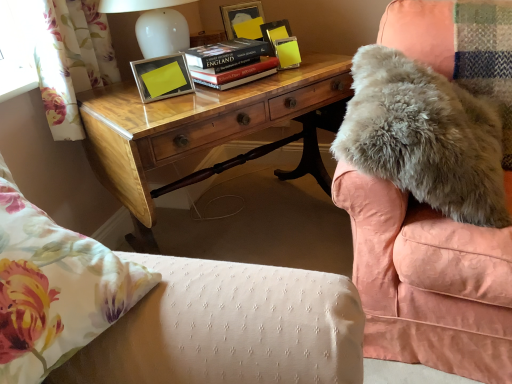
The height and width of the screenshot is (384, 512). I want to click on metallic yellow picture frame at upper center, so click(162, 77).

What are the coordinates of `floral fabric pillow at lower left` in the screenshot? It's located at (55, 288).

The image size is (512, 384). What do you see at coordinates (203, 131) in the screenshot?
I see `wooden desk at center` at bounding box center [203, 131].

This screenshot has height=384, width=512. Find the location of `wooden desk at center`. wooden desk at center is located at coordinates (203, 131).

Looking at this image, in order to face hardcover book at center, should I rotate leftwards or rightwards?

Rotate your view left by about 3.482°.

Identify the location of hardcover book at center. Image resolution: width=512 pixels, height=384 pixels. (237, 74).

The height and width of the screenshot is (384, 512). In order to click on fuzzy gray blanket at upper right in this screenshot , I will do `click(424, 137)`.

Would you consider floral fabric pillow at lower left to be distant from floral fabric curtain at left?

Indeed, floral fabric pillow at lower left is not near floral fabric curtain at left.

From the image's perspective, is floral fabric pillow at lower left beneath floral fabric curtain at left?

Yes, from the image's perspective, floral fabric pillow at lower left is below floral fabric curtain at left.

Does floral fabric pillow at lower left have a lesser width compared to floral fabric curtain at left?

No, floral fabric pillow at lower left is not thinner than floral fabric curtain at left.

Is floral fabric pillow at lower left smaller than floral fabric curtain at left?

Correct, floral fabric pillow at lower left occupies less space than floral fabric curtain at left.

Who is shorter, hardcover book at center or fuzzy gray blanket at upper right?

hardcover book at center.

From the image's perspective, is hardcover book at center beneath fuzzy gray blanket at upper right?

Actually, hardcover book at center appears above fuzzy gray blanket at upper right in the image.

Considering the relative sizes of hardcover book at center and fuzzy gray blanket at upper right in the image provided, is hardcover book at center smaller than fuzzy gray blanket at upper right?

Correct, hardcover book at center occupies less space than fuzzy gray blanket at upper right.

Considering the sizes of hardcover book at center and fuzzy gray blanket at upper right in the image, is hardcover book at center wider or thinner than fuzzy gray blanket at upper right?

hardcover book at center is thinner than fuzzy gray blanket at upper right.

From the picture: Which object is wider, floral fabric curtain at left or hardcover book at center?

hardcover book at center.

From their relative heights in the image, would you say floral fabric curtain at left is taller or shorter than hardcover book at center?

Considering their sizes, floral fabric curtain at left has more height than hardcover book at center.

Relative to hardcover book at center, is floral fabric curtain at left in front or behind?

Clearly, floral fabric curtain at left is in front of hardcover book at center.

From a real-world perspective, is floral fabric curtain at left under hardcover book at center?

Actually, floral fabric curtain at left is physically above hardcover book at center in the real world.

From their relative heights in the image, would you say hardcover book at center is taller or shorter than floral fabric pillow at lower left?

In the image, hardcover book at center appears to be shorter than floral fabric pillow at lower left.

Is hardcover book at center spatially inside floral fabric pillow at lower left, or outside of it?

hardcover book at center exists outside the volume of floral fabric pillow at lower left.

Which of these two, hardcover book at center or floral fabric pillow at lower left, is wider?

With larger width is floral fabric pillow at lower left.

What are the coordinates of `paperback book above the floral fabric pillow at lower left (from the image's perspective)` in the screenshot? It's located at (237, 74).

Considering the sizes of metallic yellow picture frame at upper center and floral fabric curtain at left in the image, is metallic yellow picture frame at upper center wider or thinner than floral fabric curtain at left?

In the image, metallic yellow picture frame at upper center appears to be more narrow than floral fabric curtain at left.

Considering the sizes of metallic yellow picture frame at upper center and floral fabric curtain at left in the image, is metallic yellow picture frame at upper center bigger or smaller than floral fabric curtain at left?

Considering their sizes, metallic yellow picture frame at upper center takes up less space than floral fabric curtain at left.

Is metallic yellow picture frame at upper center outside of floral fabric curtain at left?

Absolutely, metallic yellow picture frame at upper center is external to floral fabric curtain at left.

From the image's perspective, is floral fabric pillow at lower left on top of metallic yellow picture frame at upper center?

No, from the image's perspective, floral fabric pillow at lower left is not on top of metallic yellow picture frame at upper center.

Is point (150, 289) closer or farther from the camera than point (153, 62)?

Clearly, point (150, 289) is closer to the camera than point (153, 62).

Considering the relative sizes of floral fabric pillow at lower left and metallic yellow picture frame at upper center in the image provided, is floral fabric pillow at lower left taller than metallic yellow picture frame at upper center?

Yes.

Between floral fabric pillow at lower left and metallic yellow picture frame at upper center, which one has smaller size?

With smaller size is metallic yellow picture frame at upper center.

Between wooden desk at center and fuzzy gray blanket at upper right, which one appears on the left side from the viewer's perspective?

wooden desk at center is more to the left.

The height and width of the screenshot is (384, 512). What are the coordinates of `blanket above the wooden desk at center (from a real-world perspective)` in the screenshot? It's located at (424, 137).

How distant is wooden desk at center from fuzzy gray blanket at upper right?

wooden desk at center is 19.81 inches away from fuzzy gray blanket at upper right.

This screenshot has width=512, height=384. Find the location of `curtain positioned vertically above the floral fabric pillow at lower left (from a real-world perspective)`. curtain positioned vertically above the floral fabric pillow at lower left (from a real-world perspective) is located at coordinates (72, 60).

You are a GUI agent. You are given a task and a screenshot of the screen. Output one action in this format:
    pyautogui.click(x=<x>, y=<y>)
    Task: Click on the blanket below the hardcover book at center (from the image's perspective)
    The height and width of the screenshot is (384, 512).
    Given the screenshot: What is the action you would take?
    pyautogui.click(x=424, y=137)

Based on their spatial positions, is hardcover book at center or fuzzy gray blanket at upper right further from floral fabric pillow at lower left?

hardcover book at center.

Considering their positions, is hardcover book at center positioned further to wooden desk at center than fuzzy gray blanket at upper right?

The object further to wooden desk at center is fuzzy gray blanket at upper right.

Considering their positions, is metallic yellow picture frame at upper center positioned closer to fuzzy gray blanket at upper right than floral fabric pillow at lower left?

metallic yellow picture frame at upper center is closer to fuzzy gray blanket at upper right.

From the image, which object appears to be nearer to floral fabric curtain at left, fuzzy gray blanket at upper right or floral fabric pillow at lower left?

The object closer to floral fabric curtain at left is floral fabric pillow at lower left.

Considering their positions, is wooden desk at center positioned closer to hardcover book at center than metallic yellow picture frame at upper center?

metallic yellow picture frame at upper center is positioned closer to the anchor hardcover book at center.

Estimate the real-world distances between objects in this image. Which object is closer to floral fabric curtain at left, wooden desk at center or fuzzy gray blanket at upper right?

wooden desk at center is closer to floral fabric curtain at left.

Which object lies further to the anchor point floral fabric curtain at left, hardcover book at center or fuzzy gray blanket at upper right?

fuzzy gray blanket at upper right is positioned further to the anchor floral fabric curtain at left.

From the picture: Estimate the real-world distances between objects in this image. Which object is further from hardcover book at center, wooden desk at center or fuzzy gray blanket at upper right?

fuzzy gray blanket at upper right lies further to hardcover book at center than the other object.

This screenshot has width=512, height=384. I want to click on desk between hardcover book at center and fuzzy gray blanket at upper right from left to right, so [x=203, y=131].

Find the location of a particular element. curtain positioned between floral fabric pillow at lower left and metallic yellow picture frame at upper center from near to far is located at coordinates (72, 60).

The height and width of the screenshot is (384, 512). Identify the location of curtain positioned between floral fabric pillow at lower left and hardcover book at center from near to far. (72, 60).

Locate an element on the screen. desk situated between floral fabric pillow at lower left and fuzzy gray blanket at upper right from left to right is located at coordinates (203, 131).